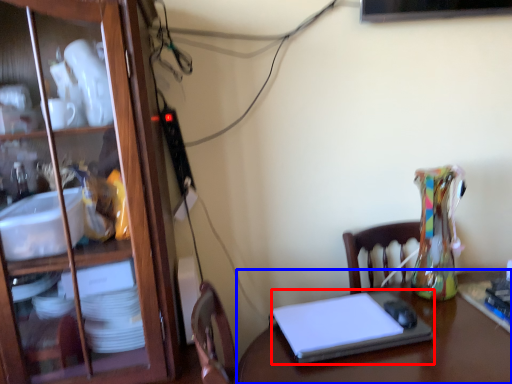
Question: Which of the following is the farthest to the observer, laptop (highlighted by a red box) or desk (highlighted by a blue box)?

Choices:
 (A) laptop
 (B) desk

Answer: (A)